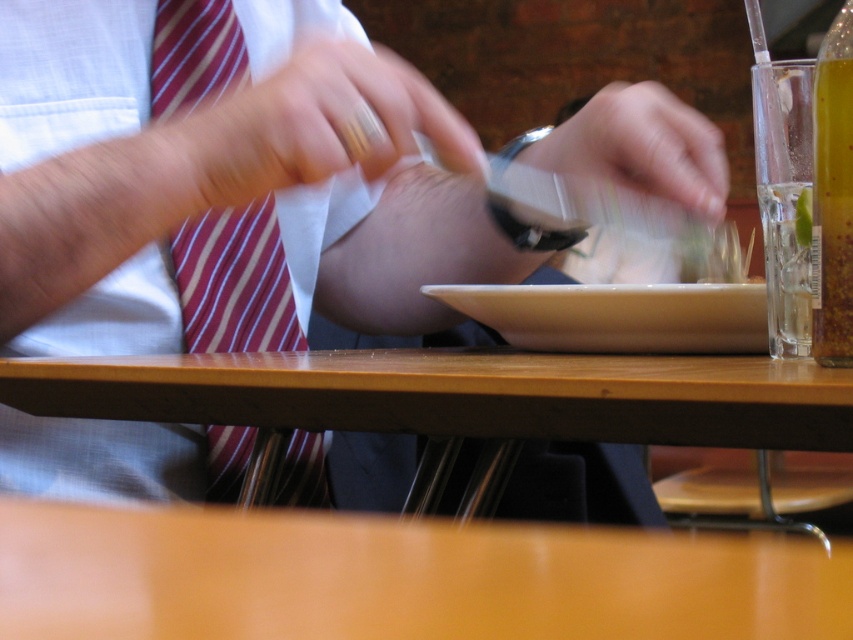
Question: Where is wooden table at center located in relation to gold metallic ring at center in the image?

Choices:
 (A) right
 (B) left

Answer: (A)

Question: Can you confirm if smooth wooden table at center is smaller than translucent glass bottle at right?

Choices:
 (A) no
 (B) yes

Answer: (A)

Question: Which of the following is the farthest from the observer?

Choices:
 (A) (19, 532)
 (B) (721, 145)

Answer: (B)

Question: Which object appears closest to the camera in this image?

Choices:
 (A) white paper napkin at center
 (B) metallic silver watch at upper center

Answer: (A)

Question: Which point is closer to the camera?

Choices:
 (A) (674, 152)
 (B) (815, 257)
 (C) (635, 321)
 (D) (196, 97)

Answer: (B)

Question: Does gold metallic ring at center have a lesser width compared to white matte plate at center?

Choices:
 (A) no
 (B) yes

Answer: (B)